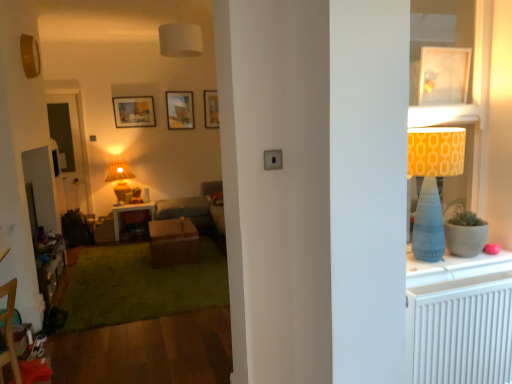
Find the location of a particular element. This screenshot has width=512, height=384. free space to the left of brown matte table at center is located at coordinates (132, 252).